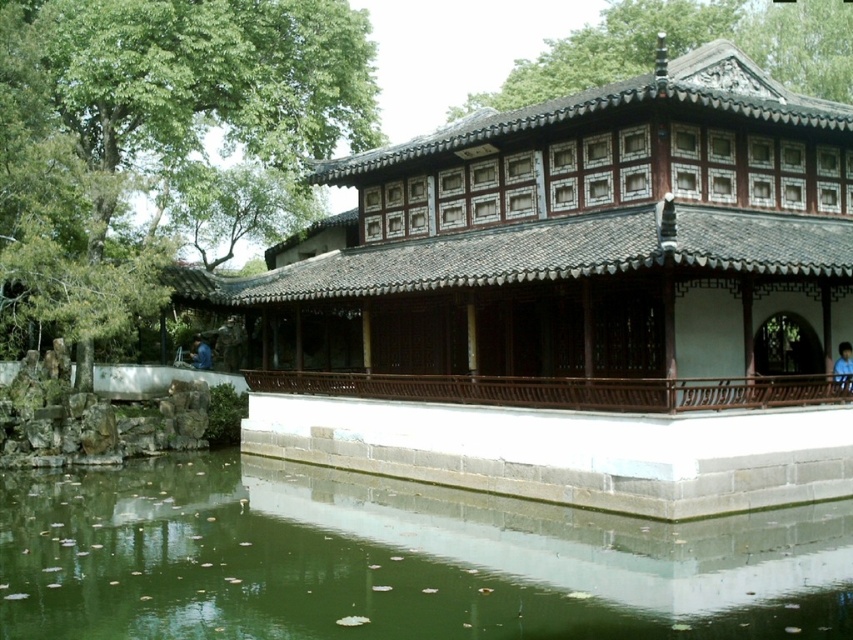
Question: Is brown wooden palace at center bigger than green water at lower left?

Choices:
 (A) yes
 (B) no

Answer: (A)

Question: Is the position of brown wooden palace at center more distant than that of green water at lower left?

Choices:
 (A) yes
 (B) no

Answer: (A)

Question: Which of the following is the closest to the observer?

Choices:
 (A) brown wooden palace at center
 (B) green water at lower left

Answer: (B)

Question: From the image, what is the correct spatial relationship of brown wooden palace at center in relation to green water at lower left?

Choices:
 (A) above
 (B) below

Answer: (A)